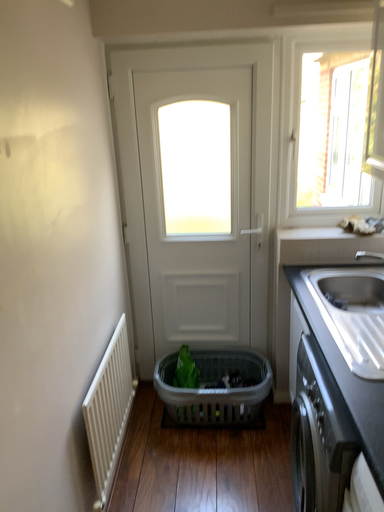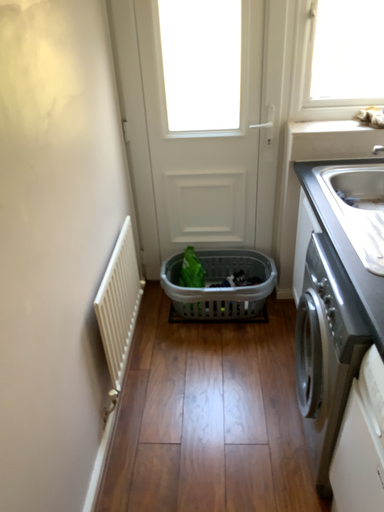
Question: Which way did the camera rotate in the video?

Choices:
 (A) rotated upward
 (B) rotated downward

Answer: (B)